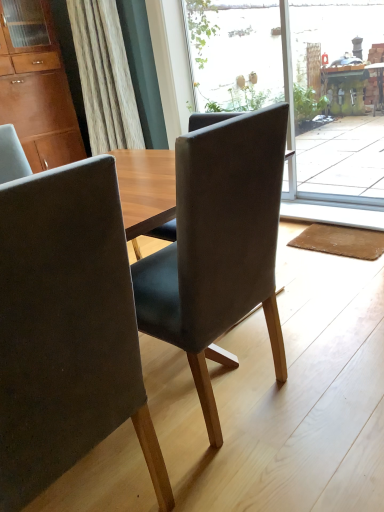
Image resolution: width=384 pixels, height=512 pixels. In order to click on free point below suede-like gray chair at center, the 2th chair positioned from the left (from a real-world perspective) in this screenshot , I will do `click(217, 395)`.